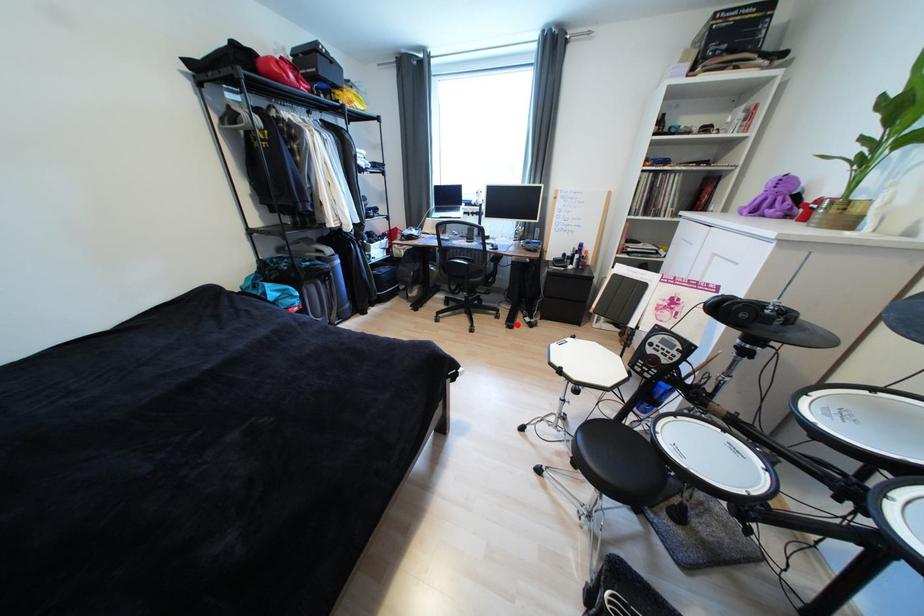
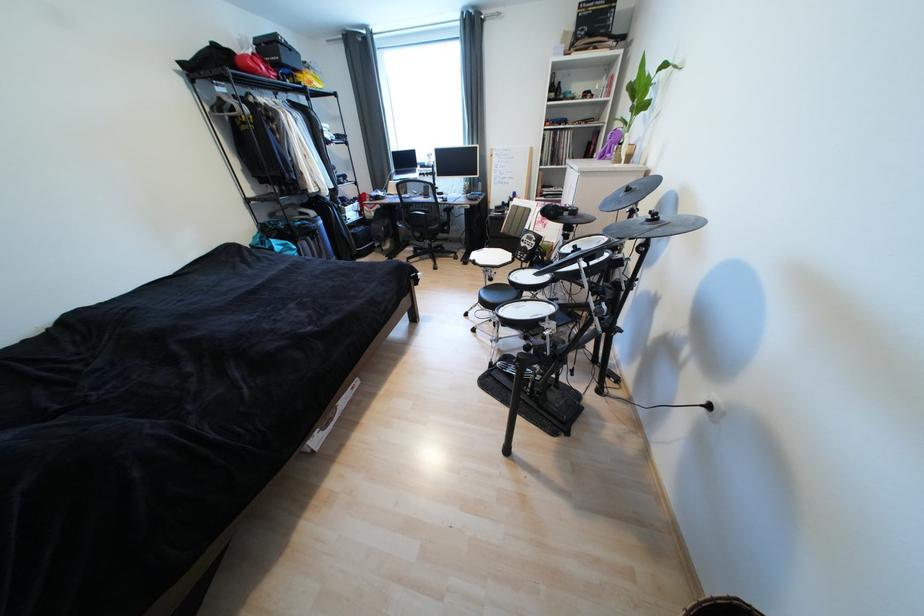
The point at the highlighted location is marked in the first image. Where is the corresponding point in the second image?

(472, 262)